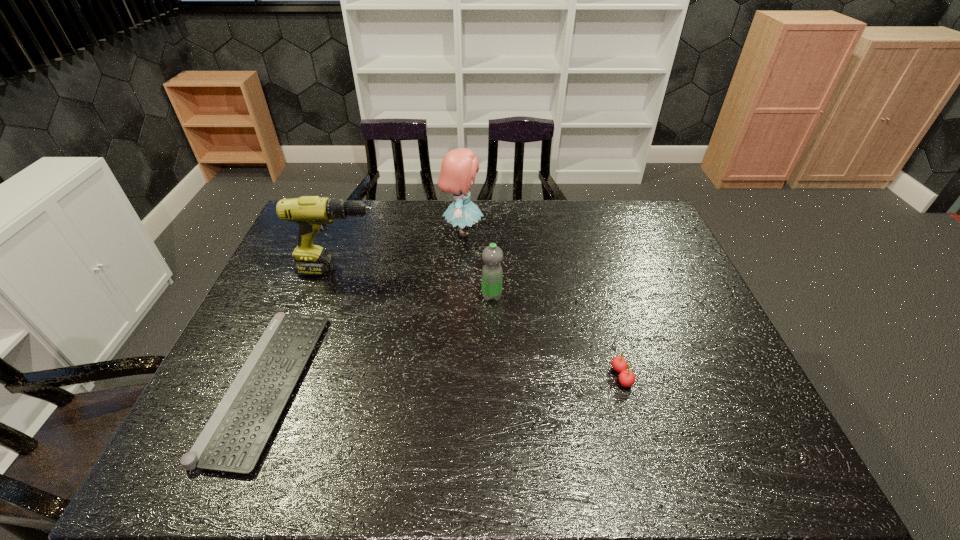
Where is `doll`? doll is located at coordinates (459, 166).

This screenshot has width=960, height=540. I want to click on drill, so click(x=312, y=213).

Locate an element on the screen. water bottle is located at coordinates (492, 274).

Where is `the third farthest object`? The height and width of the screenshot is (540, 960). the third farthest object is located at coordinates (492, 274).

Where is `the second shortest object`? the second shortest object is located at coordinates (626, 377).

Where is `the rightmost object`? This screenshot has width=960, height=540. the rightmost object is located at coordinates (626, 377).

Find the location of a particular element. This screenshot has width=960, height=540. computer keyboard is located at coordinates (233, 440).

Where is `free space located 0.210m on the front-facing side of the farthest object`? Image resolution: width=960 pixels, height=540 pixels. free space located 0.210m on the front-facing side of the farthest object is located at coordinates click(545, 231).

Find the location of a particular element. This screenshot has width=960, height=540. vacant space situated 0.390m on the handle side of the fourth nearest object is located at coordinates (510, 271).

You are a GUI agent. You are given a task and a screenshot of the screen. Output one action in this format:
    pyautogui.click(x=<x>, y=<y>)
    Task: Click on the vacant space located on the front of the third shortest object
    
    Given the screenshot: What is the action you would take?
    pyautogui.click(x=494, y=387)